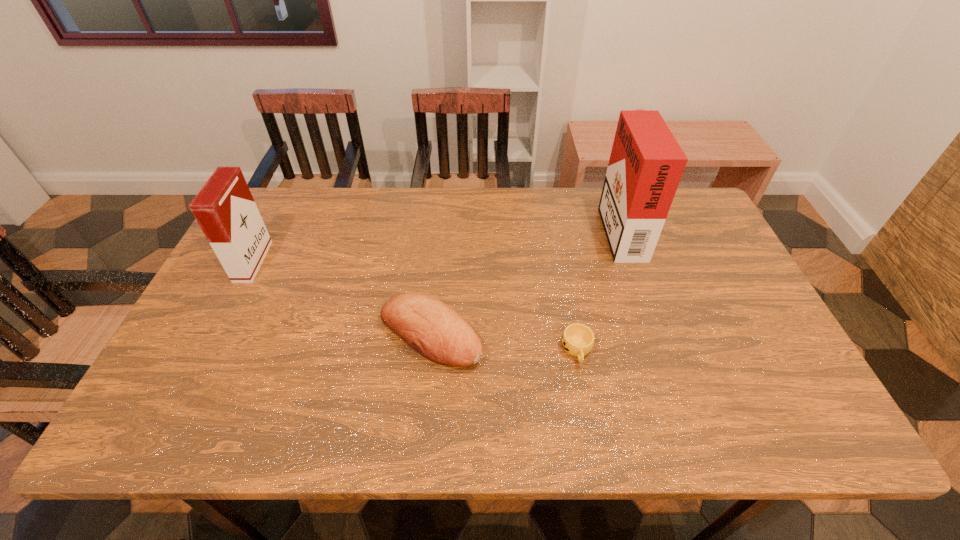
This screenshot has width=960, height=540. I want to click on the right cigarette_case, so click(x=646, y=164).

This screenshot has width=960, height=540. In order to click on the rightmost object in this screenshot , I will do `click(646, 164)`.

Where is `the leftmost object`? The width and height of the screenshot is (960, 540). the leftmost object is located at coordinates (224, 208).

This screenshot has width=960, height=540. In order to click on the left cigarette_case in this screenshot , I will do `click(224, 208)`.

What are the coordinates of `the third tallest object` in the screenshot? It's located at (436, 331).

Locate an element on the screen. The height and width of the screenshot is (540, 960). bread is located at coordinates (436, 331).

The height and width of the screenshot is (540, 960). I want to click on the second object from right to left, so click(x=578, y=339).

Locate an element on the screen. cup is located at coordinates (578, 339).

Locate an element on the screen. The width and height of the screenshot is (960, 540). free space located on the front-facing side of the tallest object is located at coordinates (560, 227).

Where is `vacant region located 0.210m on the front-facing side of the tallest object`? This screenshot has width=960, height=540. vacant region located 0.210m on the front-facing side of the tallest object is located at coordinates (538, 227).